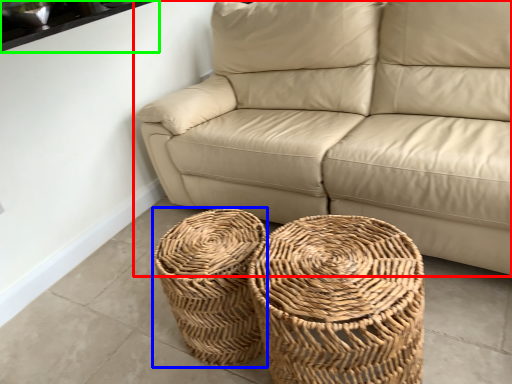
Question: Considering the real-world distances, which object is farthest from studio couch (highlighted by a red box)? basket (highlighted by a blue box) or window sill (highlighted by a green box)?

Choices:
 (A) basket
 (B) window sill

Answer: (B)